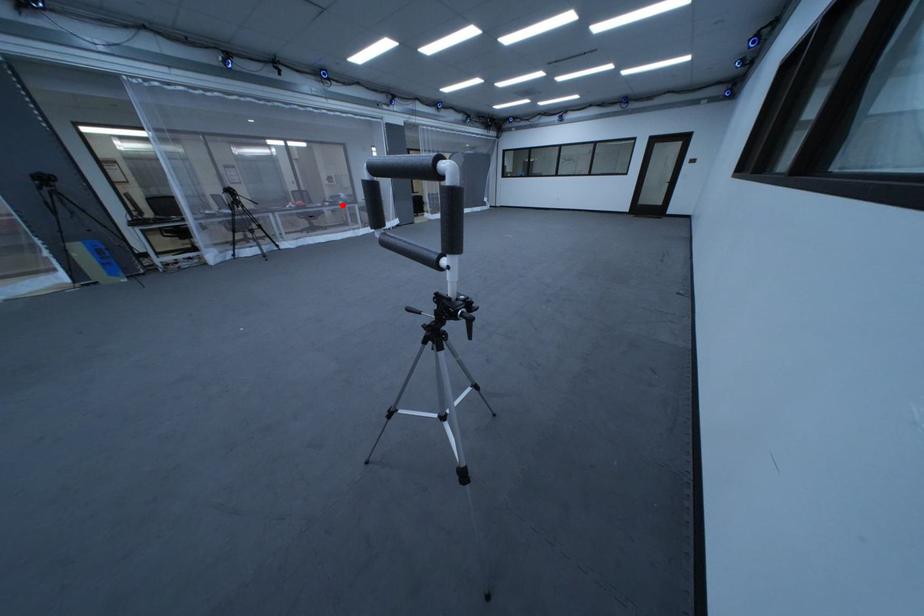
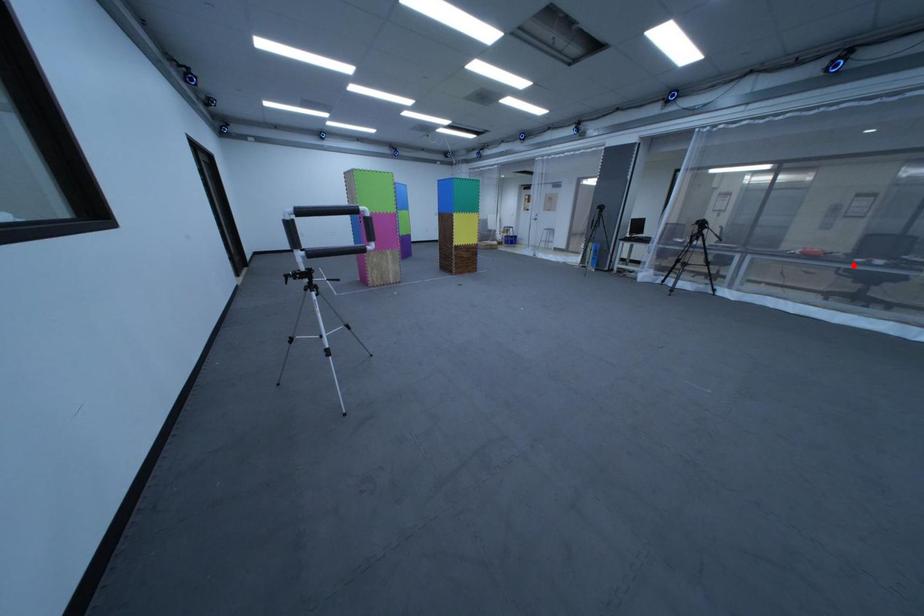
I am providing you with two images of the same scene from different viewpoints. A red point is marked on the first image and another point is marked on the second image. Are the points marked in image1 and image2 representing the same 3D position?

No